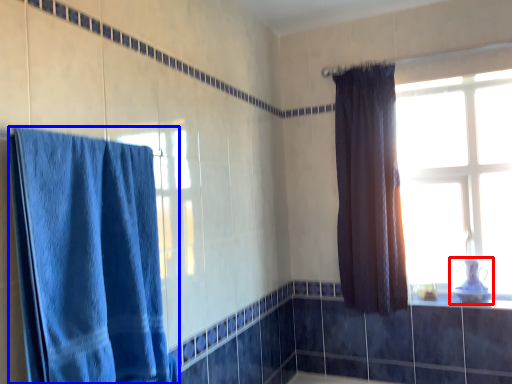
Question: Which object appears closest to the camera in this image, sink (highlighted by a red box) or curtain (highlighted by a blue box)?

Choices:
 (A) sink
 (B) curtain

Answer: (B)